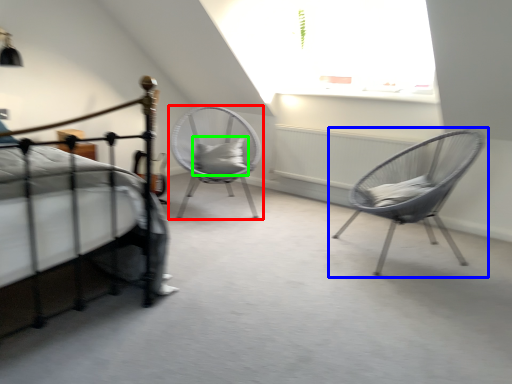
Question: Considering the real-world distances, which object is closest to chair (highlighted by a red box)? chair (highlighted by a blue box) or pillow (highlighted by a green box).

Choices:
 (A) chair
 (B) pillow

Answer: (B)